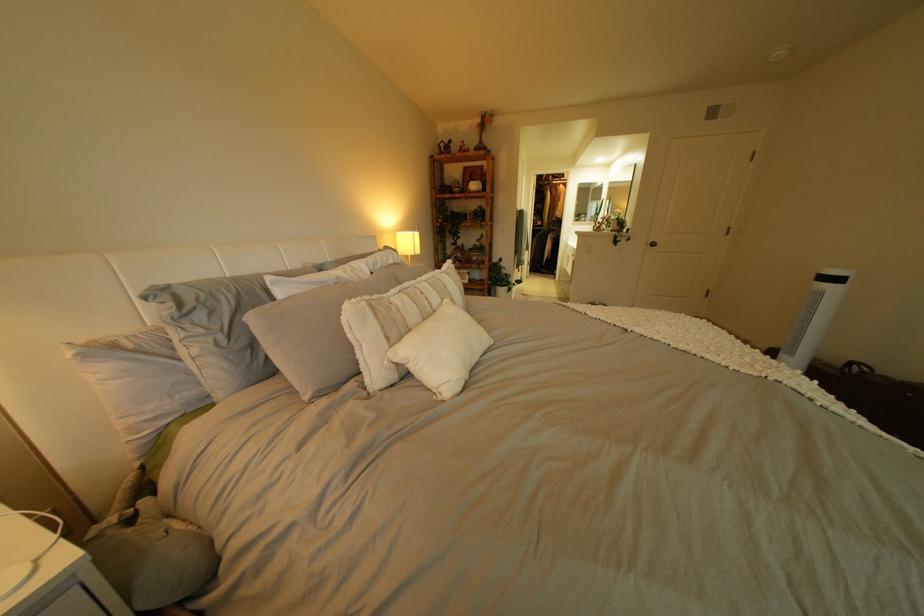
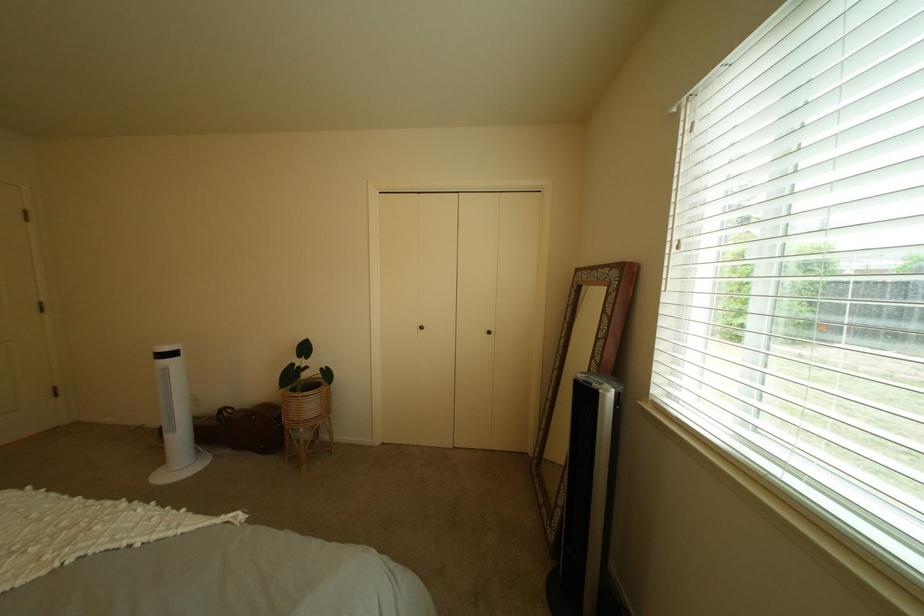
Question: The images are taken continuously from a first-person perspective. In which direction is your viewpoint rotating?

Choices:
 (A) Left
 (B) Right
 (C) Up
 (D) Down

Answer: (B)